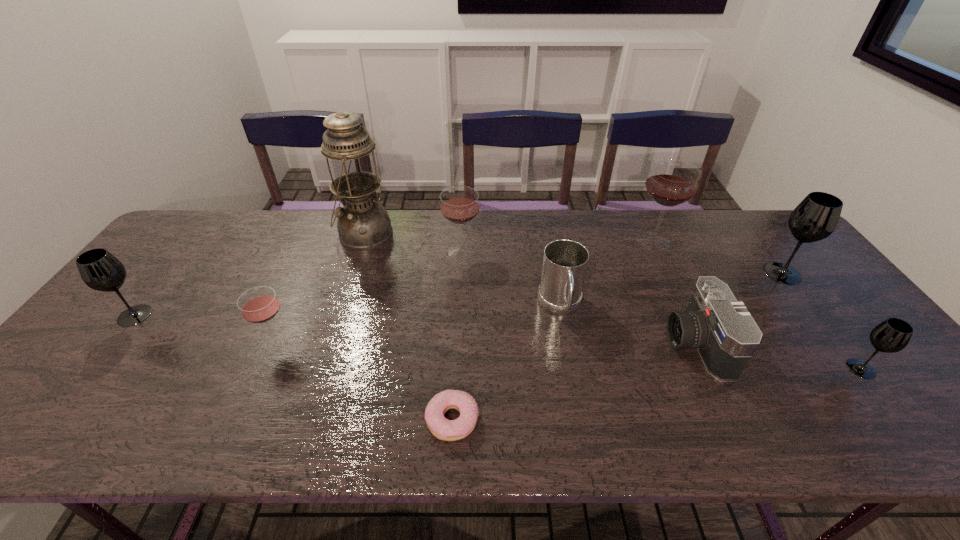
Find the location of `the smallest red wineglass`. the smallest red wineglass is located at coordinates (258, 305).

Find the location of a particular element. The image size is (960, 540). the fifth farthest wineglass is located at coordinates (258, 305).

Find the location of `the nearest gray wineglass`. the nearest gray wineglass is located at coordinates (892, 335).

The width and height of the screenshot is (960, 540). Identify the location of the nearest wineglass. (892, 335).

I want to click on camera, so click(721, 328).

Locate an element on the screen. pink doughnut is located at coordinates (448, 430).

Where is `doughnut`? The image size is (960, 540). doughnut is located at coordinates (448, 430).

At what (x,y) coordinates should I click in order to perform the action: click on free space located 0.250m on the front of the tallest object. Please return your answer as a coordinate pair (x, y). The image size is (960, 540). Looking at the image, I should click on (340, 308).

This screenshot has height=540, width=960. Identify the location of vacant space located on the left of the biggest gray wineglass. (650, 273).

Where is `vacant space located 0.180m on the right of the rightmost red wineglass`? This screenshot has height=540, width=960. vacant space located 0.180m on the right of the rightmost red wineglass is located at coordinates (732, 241).